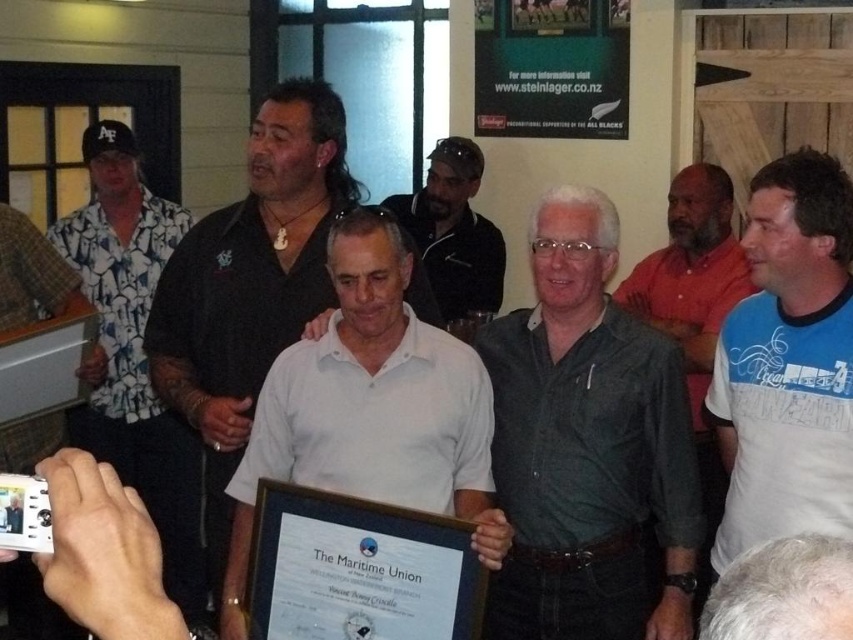
You are standing at the entrance of the venue and want to find the person wearing the matte black shirt at center. According to the coordinates provided, in which direction should you look to locate them?

To locate the matte black shirt at center, you should look towards the coordinates point at 0.447 on the x axis and 0.293 on the y axis.